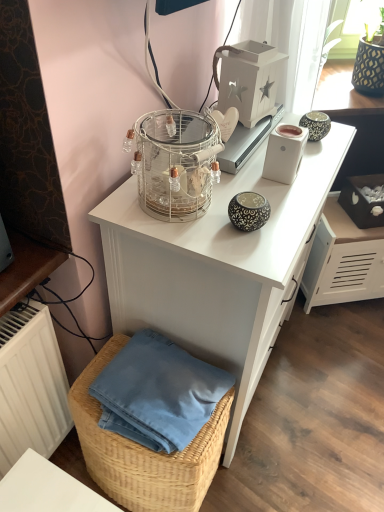
This screenshot has height=512, width=384. I want to click on free spot in front of clear glass birdcage at upper center, so click(x=190, y=238).